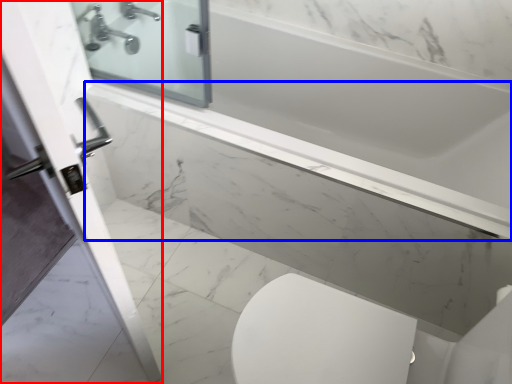
Question: Which object is further to the camera taking this photo, screen door (highlighted by a red box) or ledge (highlighted by a blue box)?

Choices:
 (A) screen door
 (B) ledge

Answer: (B)